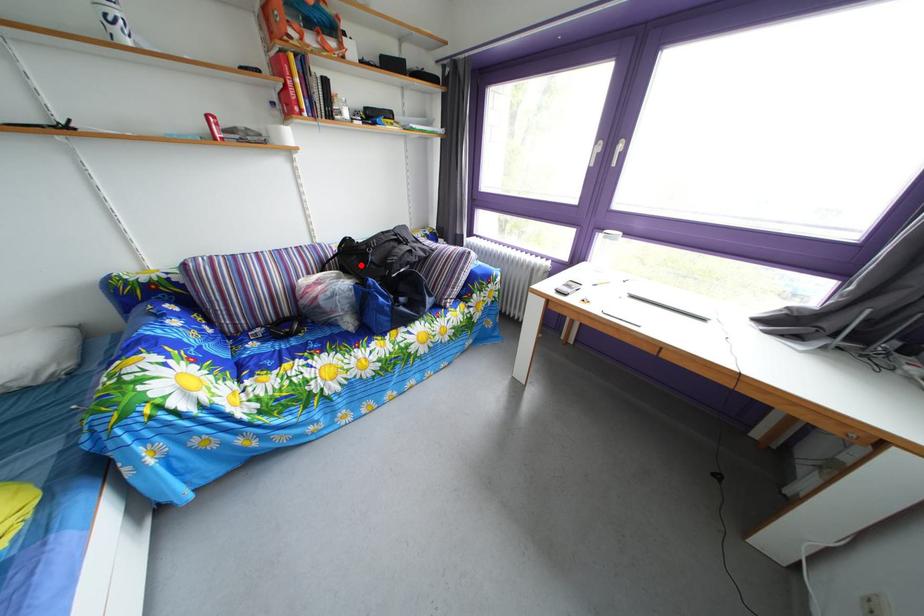
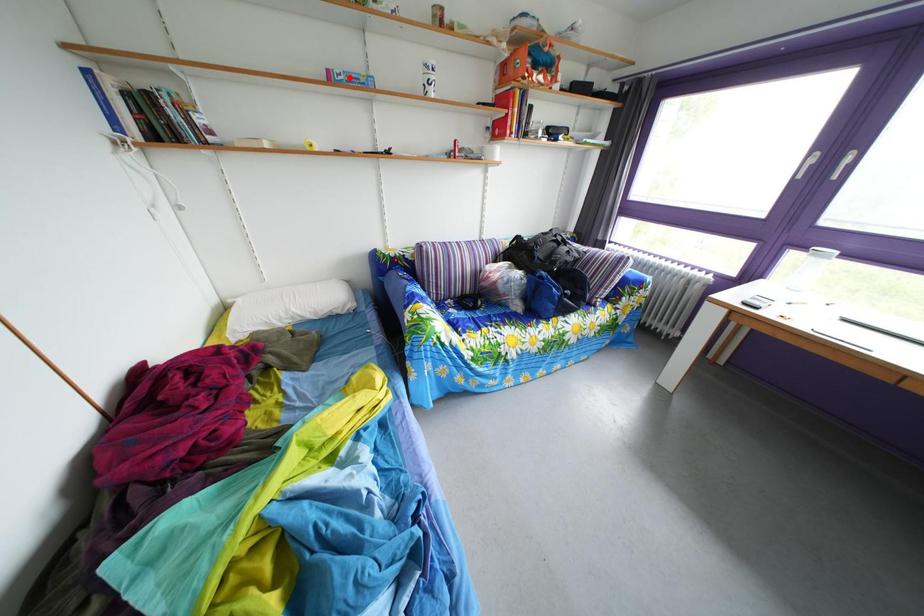
I am providing you with two images of the same scene from different viewpoints. A red point is marked on the first image and another point is marked on the second image. Do the highlighted points in image1 and image2 indicate the same real-world spot?

No